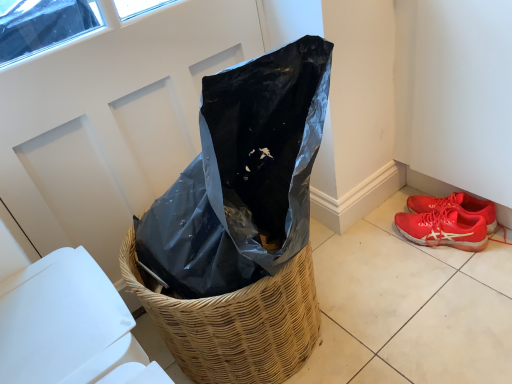
Question: Can you confirm if woven straw basket at center is positioned to the right of shiny red sneakers at lower right?

Choices:
 (A) no
 (B) yes

Answer: (A)

Question: From the image's perspective, would you say woven straw basket at center is shown under shiny red sneakers at lower right?

Choices:
 (A) yes
 (B) no

Answer: (A)

Question: Considering the relative sizes of woven straw basket at center and shiny red sneakers at lower right in the image provided, is woven straw basket at center wider than shiny red sneakers at lower right?

Choices:
 (A) yes
 (B) no

Answer: (A)

Question: Is the depth of woven straw basket at center less than that of shiny red sneakers at lower right?

Choices:
 (A) no
 (B) yes

Answer: (B)

Question: Is woven straw basket at center smaller than shiny red sneakers at lower right?

Choices:
 (A) no
 (B) yes

Answer: (A)

Question: Is shiny red sneakers at lower right inside woven straw basket at center?

Choices:
 (A) yes
 (B) no

Answer: (B)

Question: Are shiny red sneakers at lower right and woven straw basket at center making contact?

Choices:
 (A) no
 (B) yes

Answer: (A)

Question: Considering the relative sizes of shiny red sneakers at lower right and woven straw basket at center in the image provided, is shiny red sneakers at lower right wider than woven straw basket at center?

Choices:
 (A) yes
 (B) no

Answer: (B)

Question: Is shiny red sneakers at lower right not within woven straw basket at center?

Choices:
 (A) yes
 (B) no

Answer: (A)

Question: Can you confirm if shiny red sneakers at lower right is taller than woven straw basket at center?

Choices:
 (A) yes
 (B) no

Answer: (B)

Question: Would you consider shiny red sneakers at lower right to be distant from woven straw basket at center?

Choices:
 (A) yes
 (B) no

Answer: (B)

Question: From a real-world perspective, is shiny red sneakers at lower right below woven straw basket at center?

Choices:
 (A) yes
 (B) no

Answer: (A)

Question: From a real-world perspective, is shiny red sneakers at lower right above or below woven straw basket at center?

Choices:
 (A) below
 (B) above

Answer: (A)